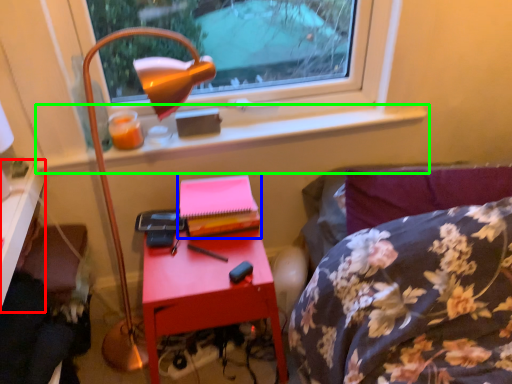
Question: Which object is the farthest from desk (highlighted by a red box)? Choose among these: paperback book (highlighted by a blue box) or window sill (highlighted by a green box).

Choices:
 (A) paperback book
 (B) window sill

Answer: (A)